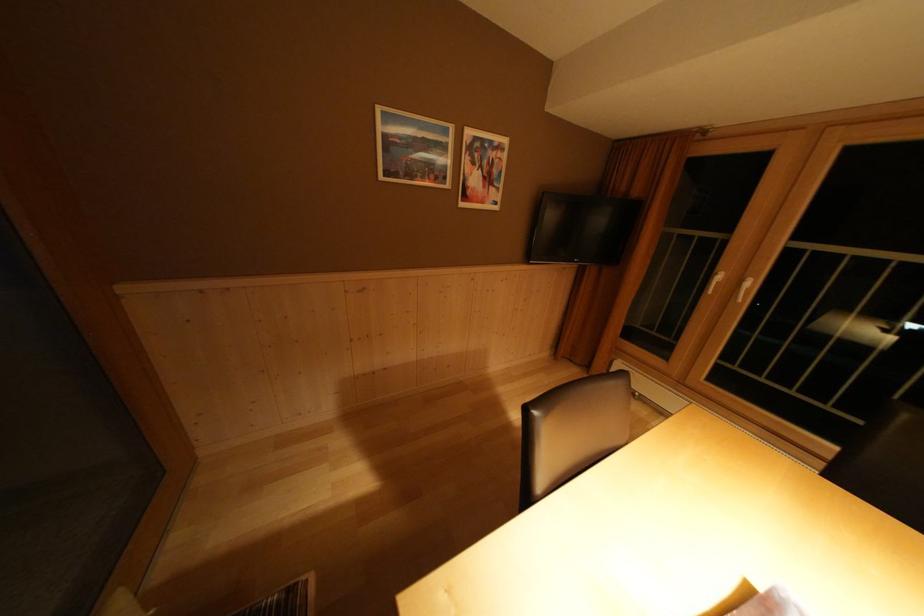
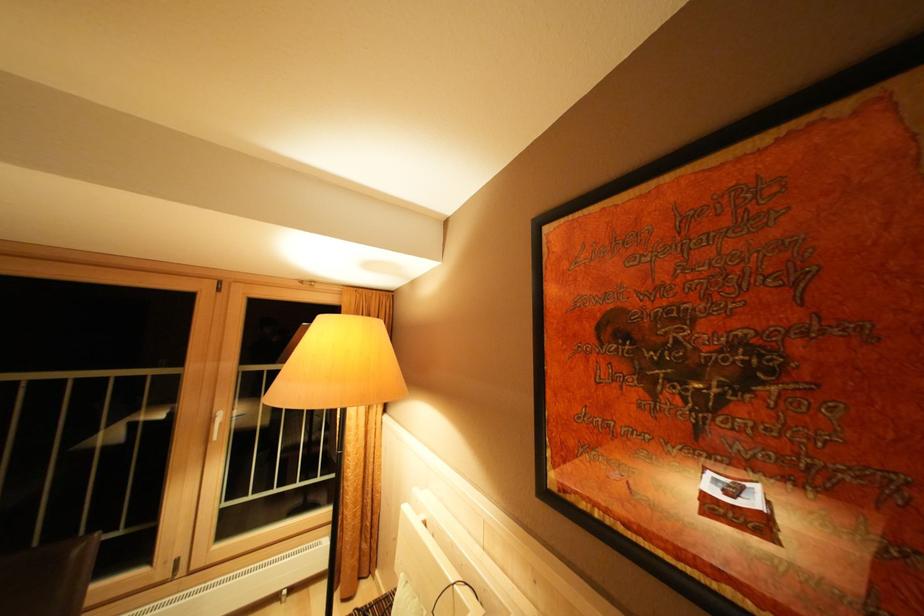
Question: The camera is either moving clockwise (left) or counter-clockwise (right) around the object. The first image is from the beginning of the video and the second image is from the end. Is the camera moving left or right when shooting the video?

Choices:
 (A) Left
 (B) Right

Answer: (A)